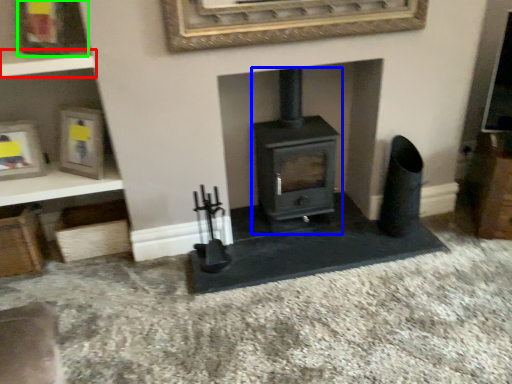
Question: Based on their relative distances, which object is nearer to shelf (highlighted by a red box)? Choose from wood burning stove (highlighted by a blue box) and picture frame (highlighted by a green box).

Choices:
 (A) wood burning stove
 (B) picture frame

Answer: (B)